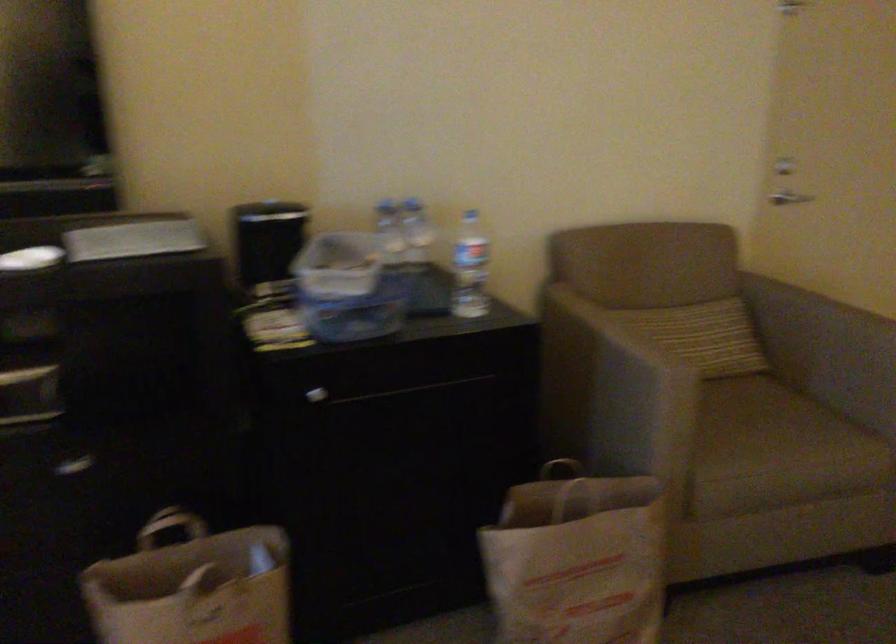
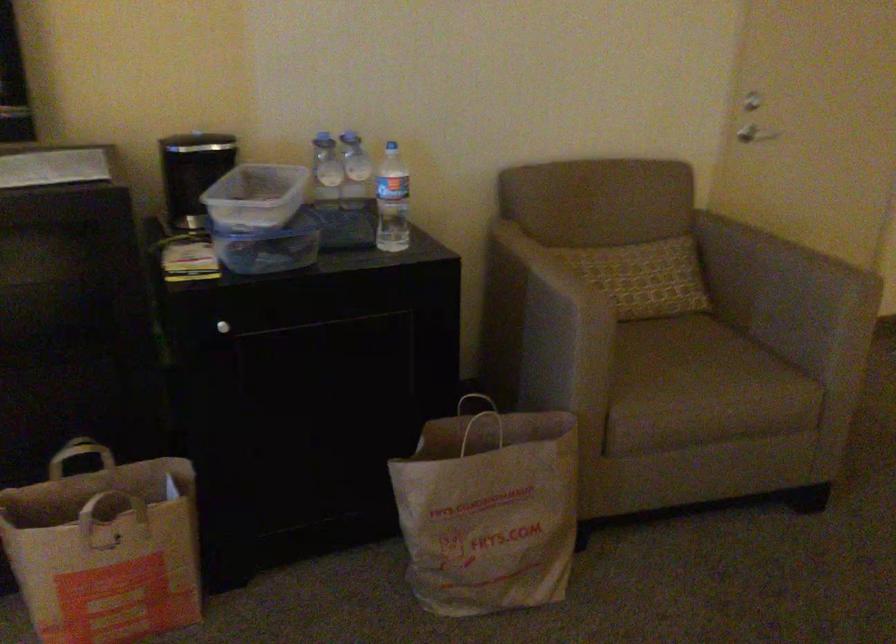
Find the pixel in the second image that matches pixel 314 395 in the first image.

(222, 327)